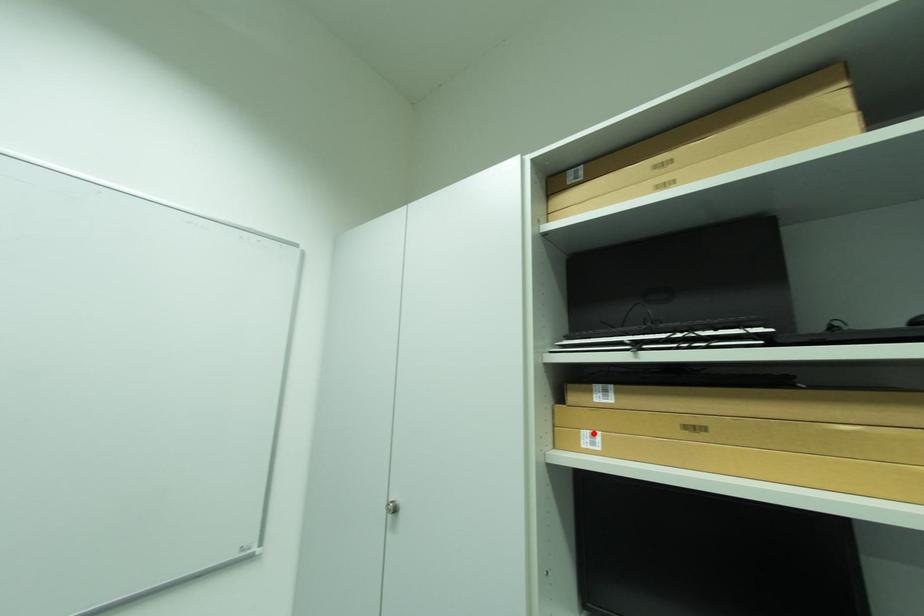
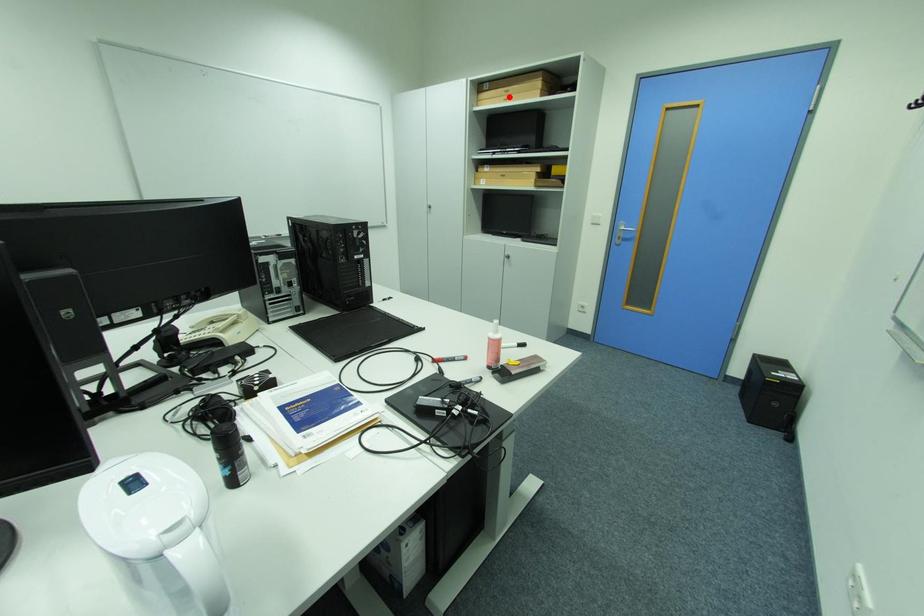
I am providing you with two images of the same scene from different viewpoints. A red point is marked on the first image and another point is marked on the second image. Is the red point in image1 aligned with the point shown in image2?

No